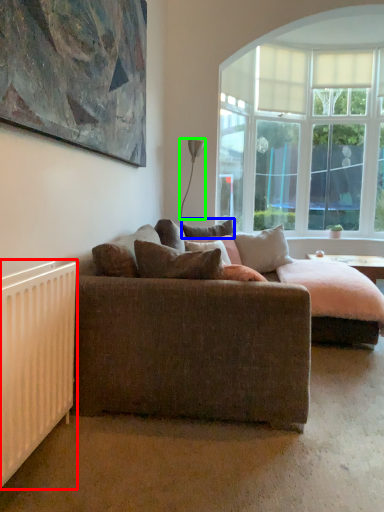
Question: Based on their relative distances, which object is farther from radiator (highlighted by a red box)? Choose from pillow (highlighted by a blue box) and lamp (highlighted by a green box).

Choices:
 (A) pillow
 (B) lamp

Answer: (B)